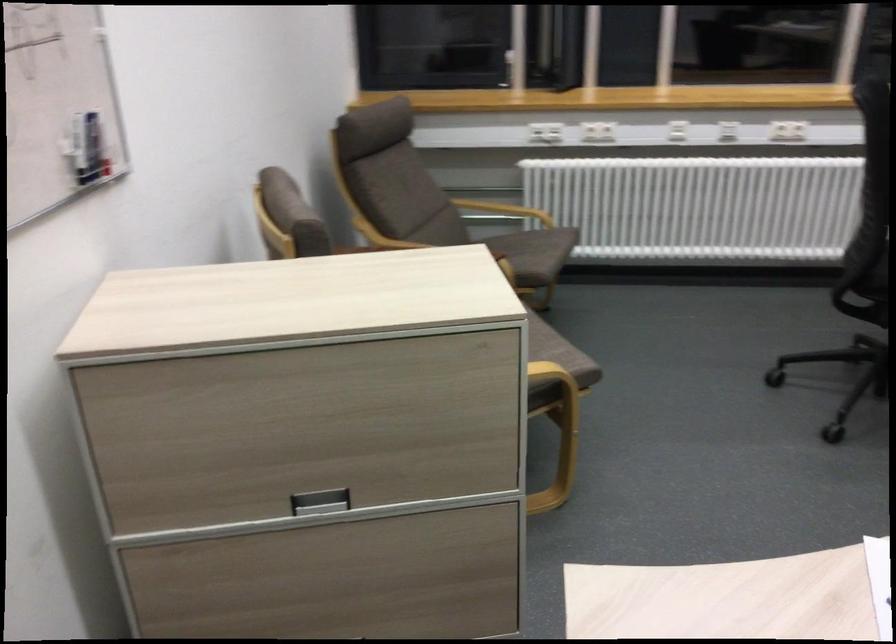
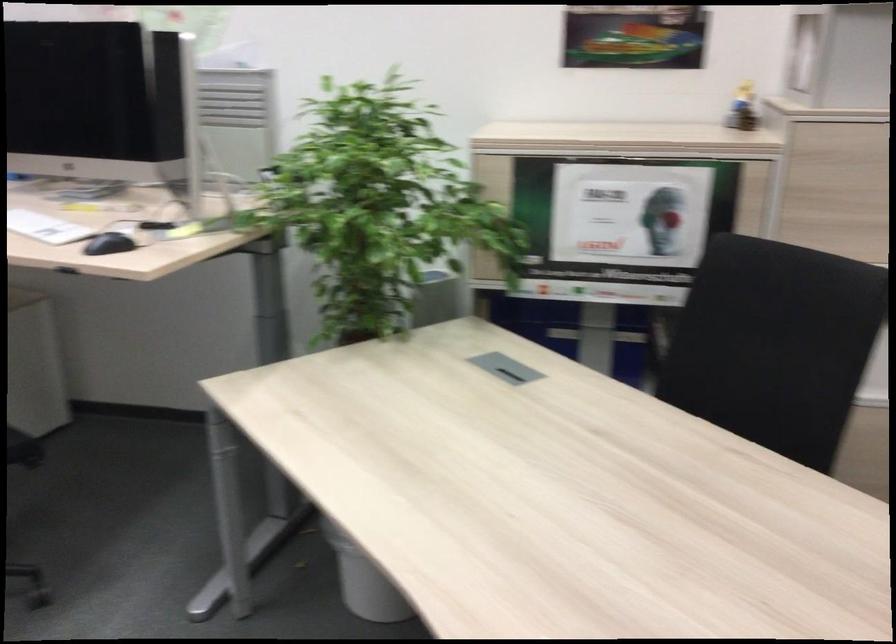
First-person continuous shooting, in which direction is the camera rotating?

The camera rotated toward right-down.